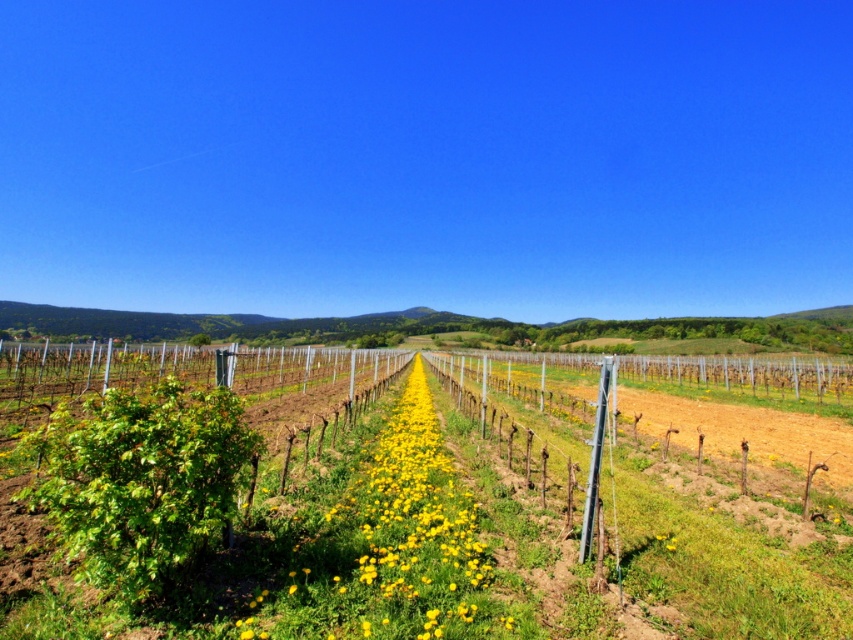
Can you confirm if green leafy vines at center is positioned above yellow soft-textured flowers at center?

Yes, green leafy vines at center is above yellow soft-textured flowers at center.

At what (x,y) coordinates should I click in order to perform the action: click on green leafy vines at center. Please return your answer as a coordinate pair (x, y). Looking at the image, I should click on (451, 545).